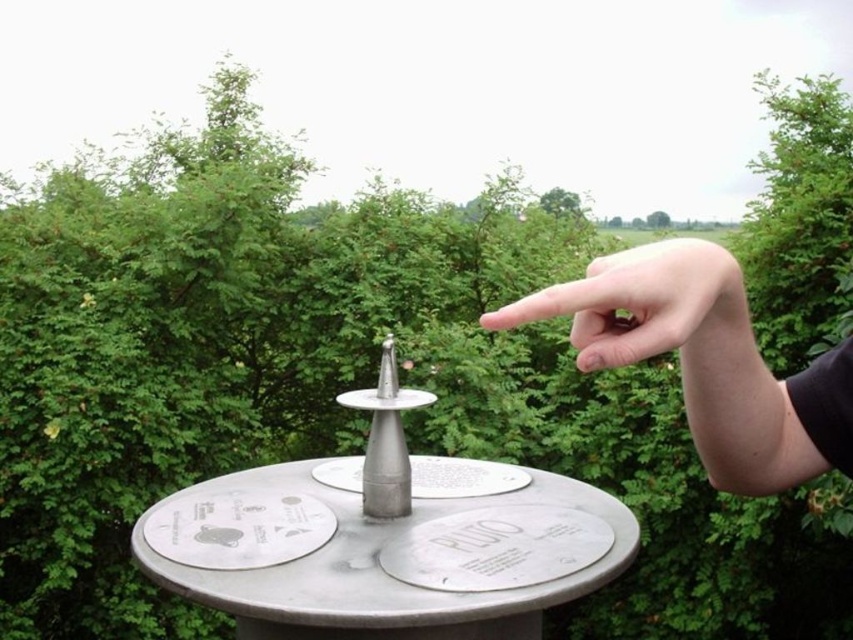
Which is more to the left, skinny flesh-colored hand at upper center or smooth skin finger at upper right?

smooth skin finger at upper right is more to the left.

What are the coordinates of `skinny flesh-colored hand at upper center` in the screenshot? It's located at (688, 355).

Identify the location of skinny flesh-colored hand at upper center. Image resolution: width=853 pixels, height=640 pixels. (688, 355).